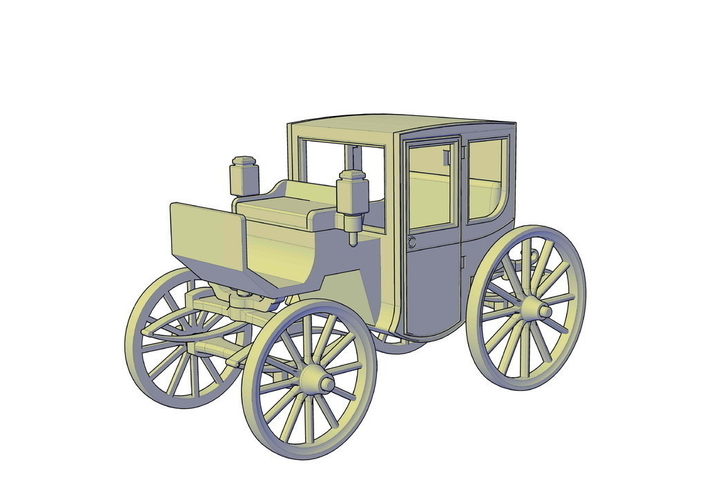
Locate an element on the screen. This screenshot has height=500, width=707. windows is located at coordinates (484, 178), (442, 175), (367, 167), (372, 164), (320, 164).